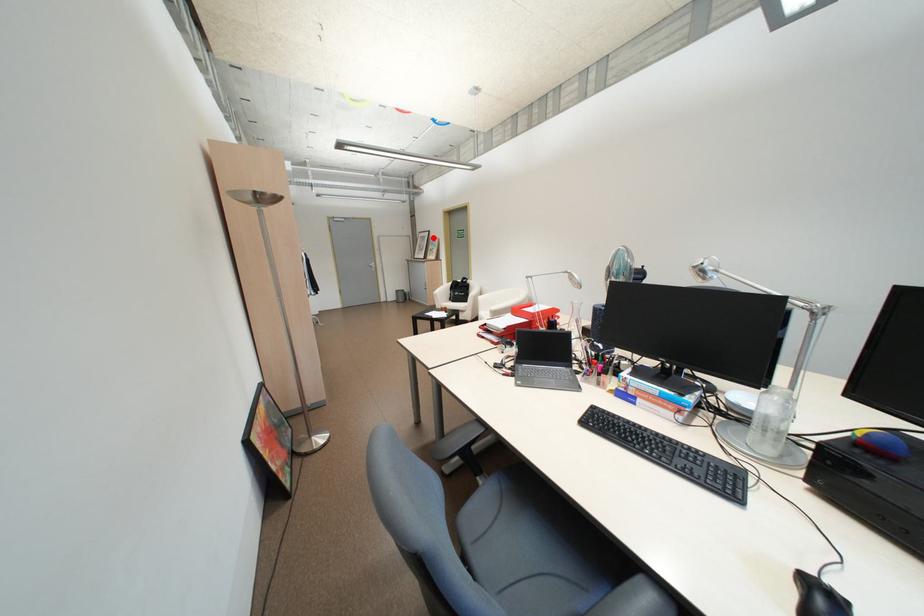
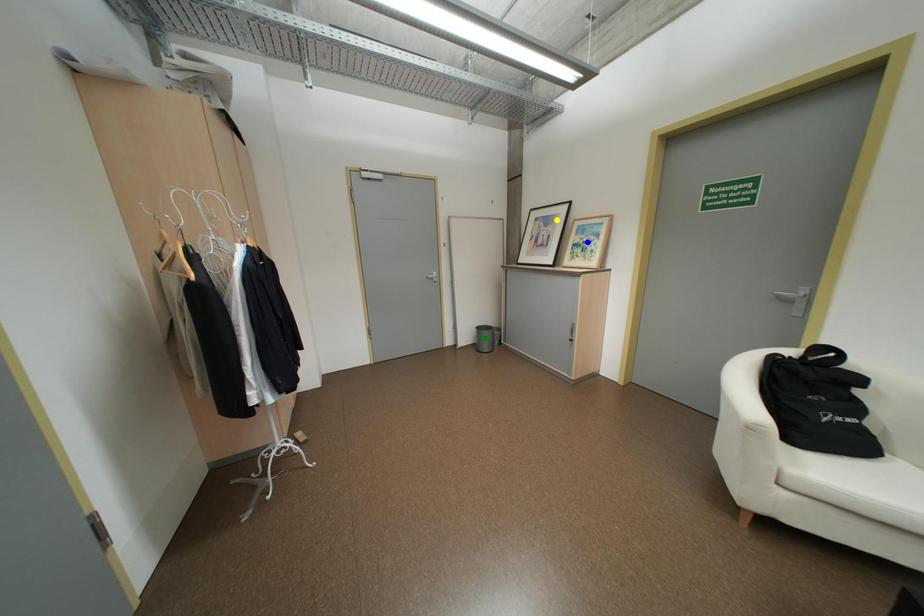
Question: I am providing you with two images of the same scene from different viewpoints. A red point is marked on the first image. You are given multiple points on the second image. Which mark in image 2 goes with the point in image 1?

Choices:
 (A) yellow point
 (B) green point
 (C) blue point

Answer: (A)